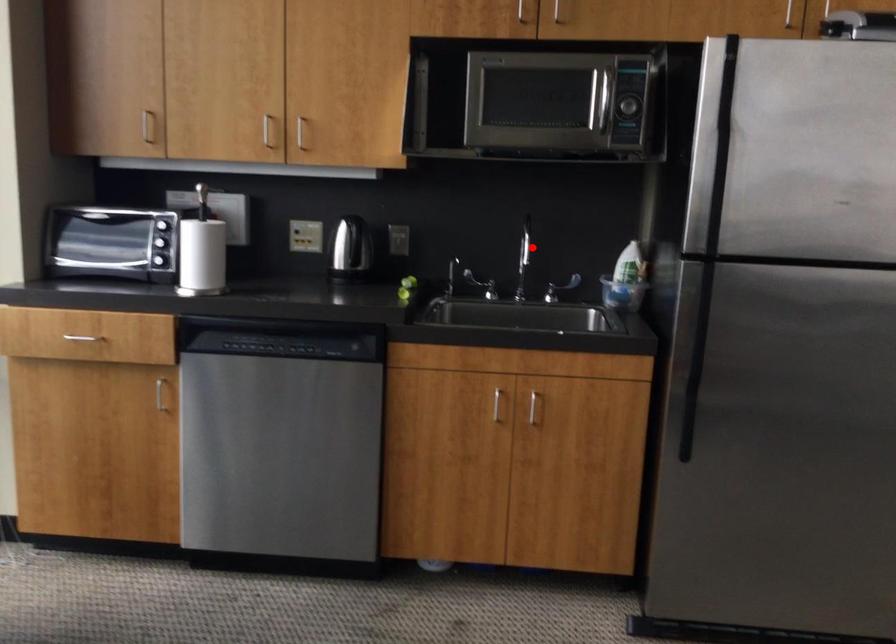
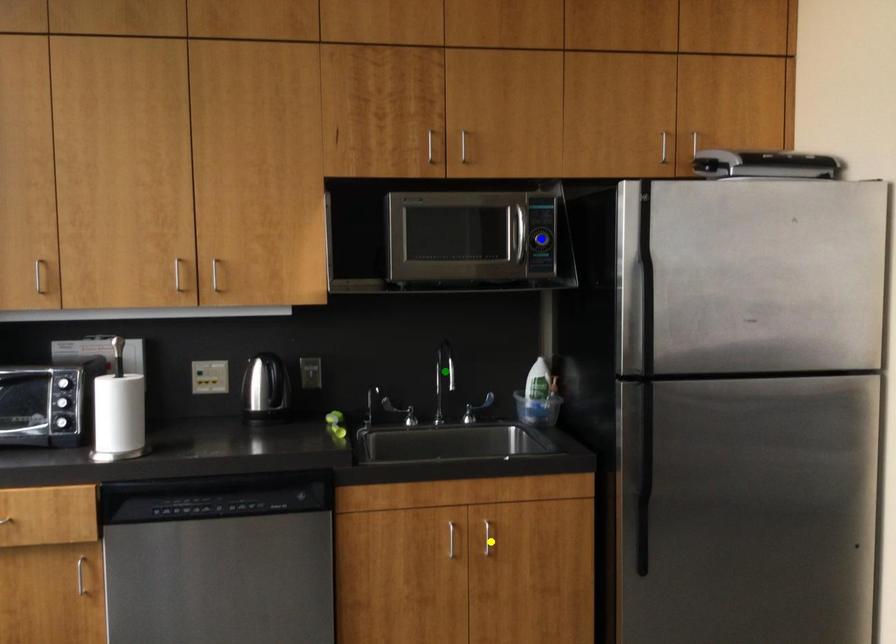
Question: I am providing you with two images of the same scene from different viewpoints. A red point is marked on the first image. You are given multiple points on the second image. Can you choose the point in image 2 that corresponds to the point in image 1?

Choices:
 (A) green point
 (B) blue point
 (C) yellow point

Answer: (A)